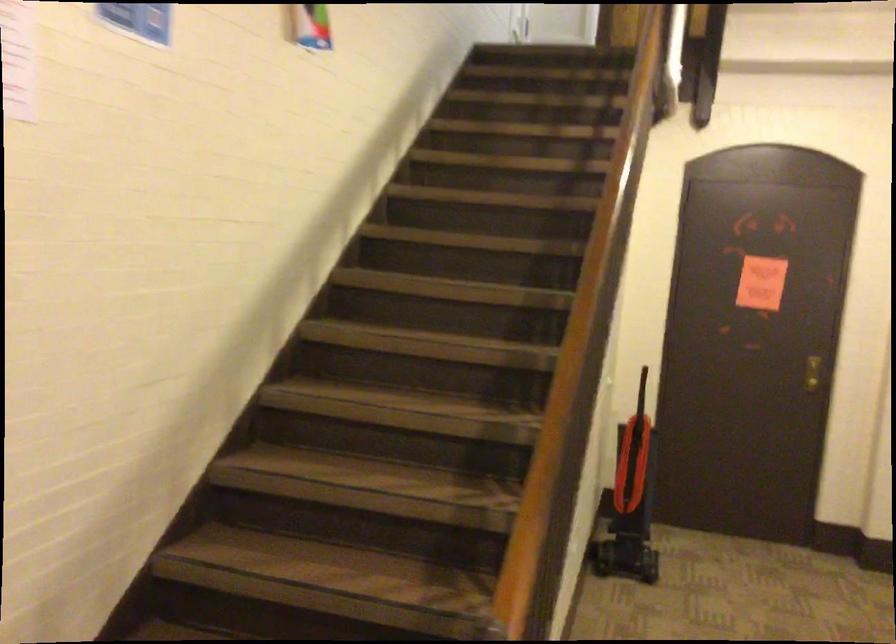
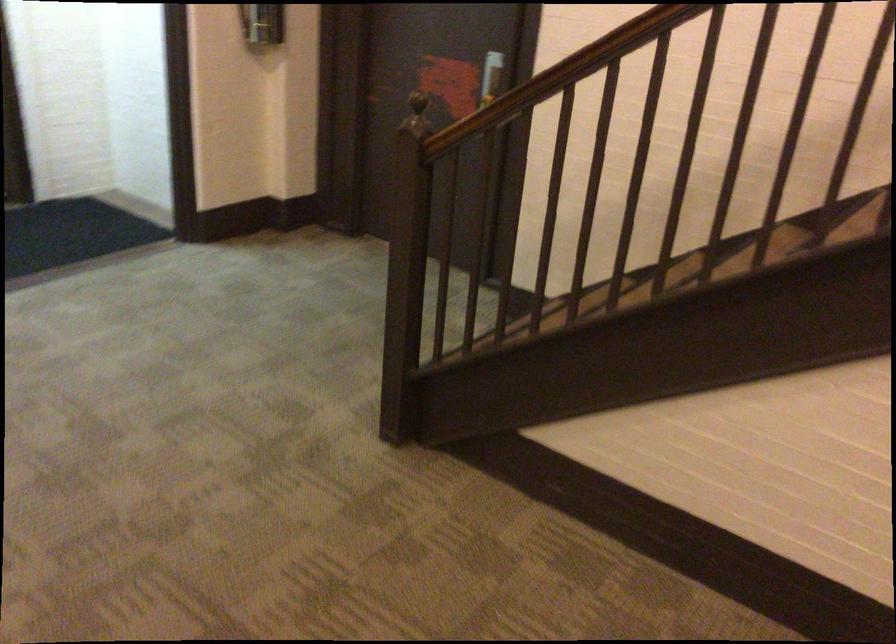
The point at (558, 486) is marked in the first image. Where is the corresponding point in the second image?

(546, 80)